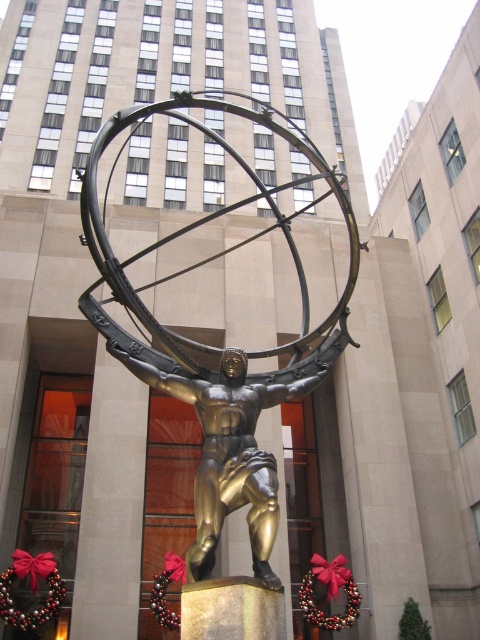
You are an art curator planning to display both the gold polished statue at center and the gold metallic statue at center in a gallery. Given their heights, which statue should be placed on a taller base to ensure they appear balanced in the exhibition?

The gold polished statue at center has a greater height compared to the gold metallic statue at center. To balance their overall appearance in the exhibition, the gold metallic statue at center should be placed on a taller base so that both statues reach a similar total height when including their bases.

You are an art student analyzing the image of a statue. You notice two mentions of a gold statue at the center. According to the description, how is the gold polished statue at center positioned relative to the gold metallic statue at center?

The gold polished statue at center is above the gold metallic statue at center.

You are standing in front of the bronze statue of Atlas holding a celestial sphere in front of a modern building. There is a point at coordinates point [152,244]. Can you walk to that point from your current position?

The point at point [152,244] is 27.39 meters away from the camera, so yes, you can walk to that point from your current position as it is within a reachable distance.